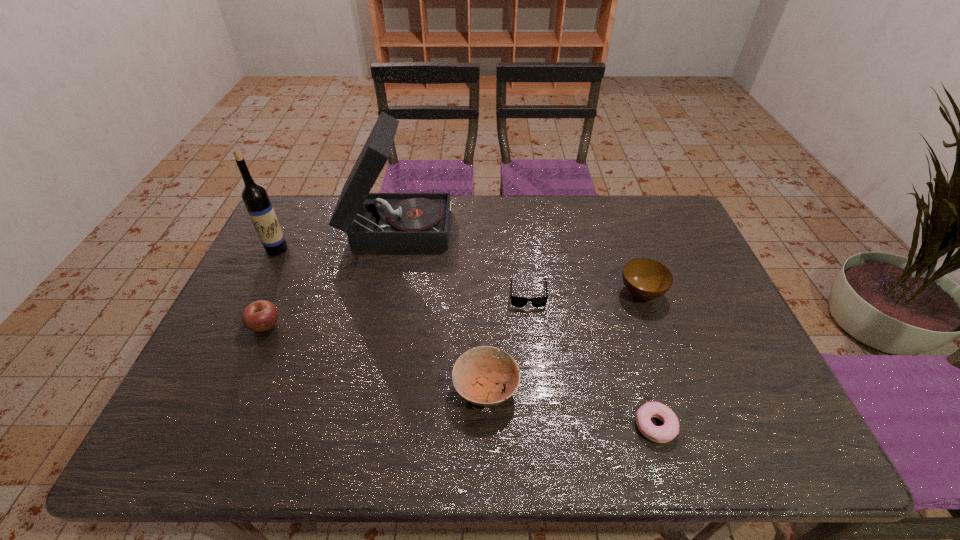
Where is `empty space between the sunglasses and the farther bowl`? This screenshot has width=960, height=540. empty space between the sunglasses and the farther bowl is located at coordinates (585, 293).

I want to click on unoccupied area between the wine bottle and the sunglasses, so click(402, 271).

Identify the location of free space between the wine bottle and the apple. (272, 287).

Find the location of a particular element. vacant point located between the left bowl and the second shortest object is located at coordinates (507, 341).

Find the location of a particular element. The height and width of the screenshot is (540, 960). vacant area that lies between the fifth object from right to left and the apple is located at coordinates (332, 274).

Select which object is the closest to the wine bottle. Please provide its 2D coordinates. Your answer should be formatted as a tuple, i.e. [(x, y)], where the tuple contains the x and y coordinates of a point satisfying the conditions above.

[(373, 221)]

Locate an element on the screen. Image resolution: width=960 pixels, height=540 pixels. object that is the closest to the nearer bowl is located at coordinates (516, 301).

Find the location of a particular element. This screenshot has width=960, height=540. vacant position in the image that satisfies the following two spatial constraints: 1. on the front-facing side of the doughnut; 2. on the right side of the phonograph_record is located at coordinates (355, 426).

Locate an element on the screen. Image resolution: width=960 pixels, height=540 pixels. free spot that satisfies the following two spatial constraints: 1. on the label of the farther bowl; 2. on the right side of the wine bottle is located at coordinates (255, 293).

The height and width of the screenshot is (540, 960). Identify the location of free location that satisfies the following two spatial constraints: 1. on the front-facing side of the phonograph_record; 2. on the label of the wine bottle. (393, 249).